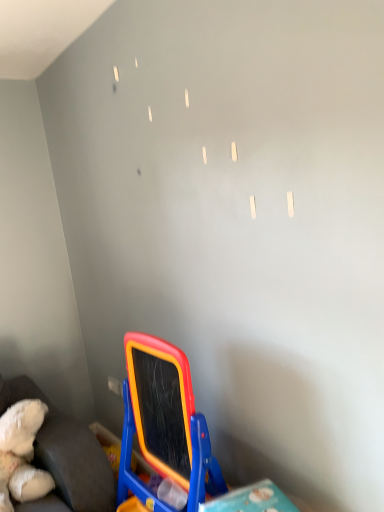
Question: Considering the relative sizes of white plush teddy bear at lower left and rubberized plastic easel at lower center in the image provided, is white plush teddy bear at lower left thinner than rubberized plastic easel at lower center?

Choices:
 (A) yes
 (B) no

Answer: (B)

Question: Is there a large distance between white plush teddy bear at lower left and rubberized plastic easel at lower center?

Choices:
 (A) no
 (B) yes

Answer: (A)

Question: Considering the relative positions of white plush teddy bear at lower left and rubberized plastic easel at lower center in the image provided, is white plush teddy bear at lower left behind rubberized plastic easel at lower center?

Choices:
 (A) yes
 (B) no

Answer: (A)

Question: Is white plush teddy bear at lower left facing towards rubberized plastic easel at lower center?

Choices:
 (A) yes
 (B) no

Answer: (B)

Question: Does white plush teddy bear at lower left contain rubberized plastic easel at lower center?

Choices:
 (A) yes
 (B) no

Answer: (B)

Question: Is white plush teddy bear at lower left taller than rubberized plastic easel at lower center?

Choices:
 (A) no
 (B) yes

Answer: (A)

Question: Is rubberized plastic easel at lower center positioned in front of white plush teddy bear at lower left?

Choices:
 (A) yes
 (B) no

Answer: (A)

Question: Does rubberized plastic easel at lower center have a smaller size compared to white plush teddy bear at lower left?

Choices:
 (A) yes
 (B) no

Answer: (B)

Question: Is rubberized plastic easel at lower center oriented towards white plush teddy bear at lower left?

Choices:
 (A) yes
 (B) no

Answer: (B)

Question: Is rubberized plastic easel at lower center directly adjacent to white plush teddy bear at lower left?

Choices:
 (A) yes
 (B) no

Answer: (B)

Question: Does rubberized plastic easel at lower center have a lesser height compared to white plush teddy bear at lower left?

Choices:
 (A) no
 (B) yes

Answer: (A)

Question: From the image's perspective, does rubberized plastic easel at lower center appear lower than white plush teddy bear at lower left?

Choices:
 (A) yes
 (B) no

Answer: (B)

Question: Looking at the image, does rubberized plastic easel at lower center seem bigger or smaller compared to white plush teddy bear at lower left?

Choices:
 (A) big
 (B) small

Answer: (A)